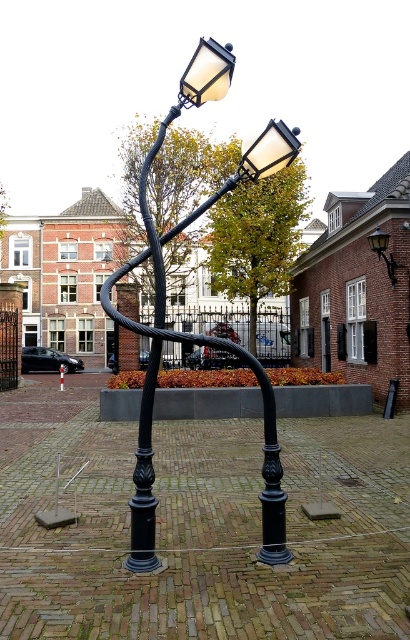
Which is behind, point (282, 556) or point (275, 147)?

Positioned behind is point (275, 147).

Does black matte lamp post at center have a smaller size compared to matte black streetlight at upper center?

Result: Incorrect, black matte lamp post at center is not smaller in size than matte black streetlight at upper center.

Does point (287, 556) lie behind point (273, 152)?

No, (287, 556) is in front of (273, 152).

I want to click on black matte lamp post at center, so click(155, 381).

Which is above, matte glass streetlight at upper center or matte black streetlight at upper center?

matte glass streetlight at upper center is above.

Between point (209, 54) and point (261, 163), which one is positioned in front?

Point (209, 54) is more forward.

Identify the location of matte glass streetlight at upper center. This screenshot has height=640, width=410. (207, 74).

Between black matte lamp post at center and matte black lamp at upper right, which one appears on the right side from the viewer's perspective?

From the viewer's perspective, matte black lamp at upper right appears more on the right side.

Does black matte lamp post at center have a lesser width compared to matte black lamp at upper right?

Incorrect, black matte lamp post at center's width is not less than matte black lamp at upper right's.

Consider the image. Who is more distant from viewer, (x=236, y=177) or (x=389, y=257)?

Positioned behind is point (x=389, y=257).

You are a GUI agent. You are given a task and a screenshot of the screen. Output one action in this format:
    pyautogui.click(x=<x>, y=<y>)
    Task: Click on the black matte lamp post at center
    Image resolution: width=410 pixels, height=640 pixels.
    Given the screenshot: What is the action you would take?
    pyautogui.click(x=155, y=381)